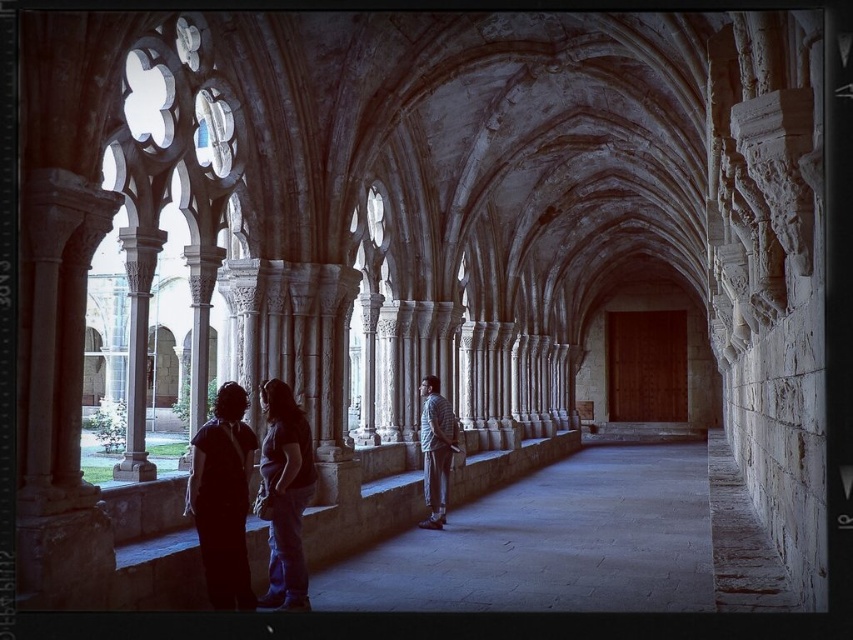
Question: Does dark fabric dress at lower left have a smaller size compared to plaid shirt at center?

Choices:
 (A) yes
 (B) no

Answer: (A)

Question: Estimate the real-world distances between objects in this image. Which object is closer to the dark gray fabric shirt at center?

Choices:
 (A) dark fabric dress at lower left
 (B) plaid shirt at center

Answer: (A)

Question: Which object appears farthest from the camera in this image?

Choices:
 (A) dark fabric dress at lower left
 (B) plaid shirt at center
 (C) dark gray fabric shirt at center

Answer: (B)

Question: Can you confirm if dark fabric dress at lower left is wider than dark gray fabric shirt at center?

Choices:
 (A) no
 (B) yes

Answer: (B)

Question: Which of the following is the closest to the observer?

Choices:
 (A) plaid shirt at center
 (B) dark fabric dress at lower left

Answer: (B)

Question: Is dark fabric dress at lower left above plaid shirt at center?

Choices:
 (A) no
 (B) yes

Answer: (B)